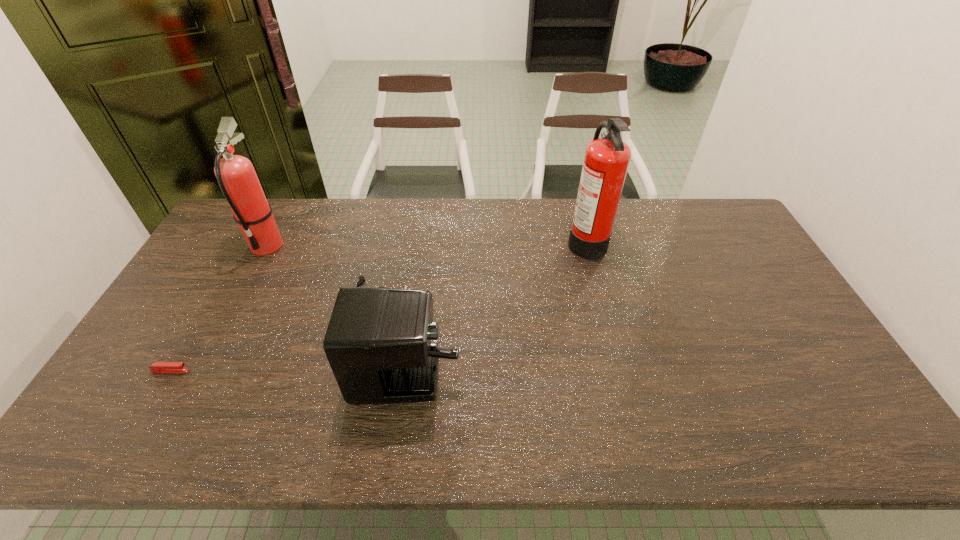
Find the location of a particular element. This screenshot has height=540, width=960. free space located on the front-facing side of the stapler is located at coordinates (234, 371).

Where is `fire extinguisher situated at the left edge`? The height and width of the screenshot is (540, 960). fire extinguisher situated at the left edge is located at coordinates (236, 176).

The image size is (960, 540). I want to click on stapler that is at the left edge, so click(x=158, y=367).

Locate an element on the screen. object that is at the far left corner is located at coordinates (236, 176).

Image resolution: width=960 pixels, height=540 pixels. What are the coordinates of `blank space at the far edge` in the screenshot? It's located at (540, 200).

You are a GUI agent. You are given a task and a screenshot of the screen. Output one action in this format:
    pyautogui.click(x=<x>, y=<y>)
    Task: Click on the free region at the near edge of the desktop
    
    Given the screenshot: What is the action you would take?
    pyautogui.click(x=411, y=420)

Find the location of a particular element. The height and width of the screenshot is (540, 960). blank space at the left edge of the desktop is located at coordinates (219, 266).

Find the location of `vacant area at the right edge of the desktop`. vacant area at the right edge of the desktop is located at coordinates (791, 374).

You are a GUI agent. You are given a task and a screenshot of the screen. Output one action in this format:
    pyautogui.click(x=<x>, y=<y>)
    Task: Click on the vacant space at the near left corner
    The width and height of the screenshot is (960, 540).
    Given the screenshot: What is the action you would take?
    pyautogui.click(x=103, y=435)

Identify the location of vacant point located between the coffee maker and the left fire extinguisher. The width and height of the screenshot is (960, 540). (331, 289).